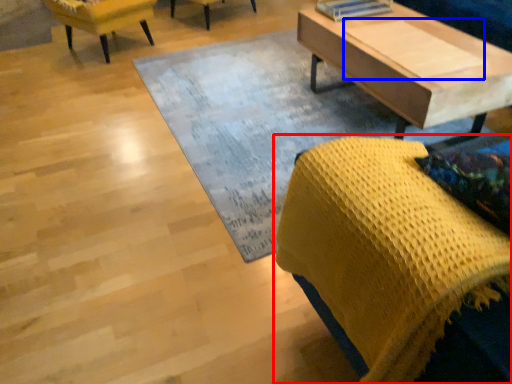
Question: Which object is closer to the camera taking this photo, chair (highlighted by a red box) or plank (highlighted by a blue box)?

Choices:
 (A) chair
 (B) plank

Answer: (A)